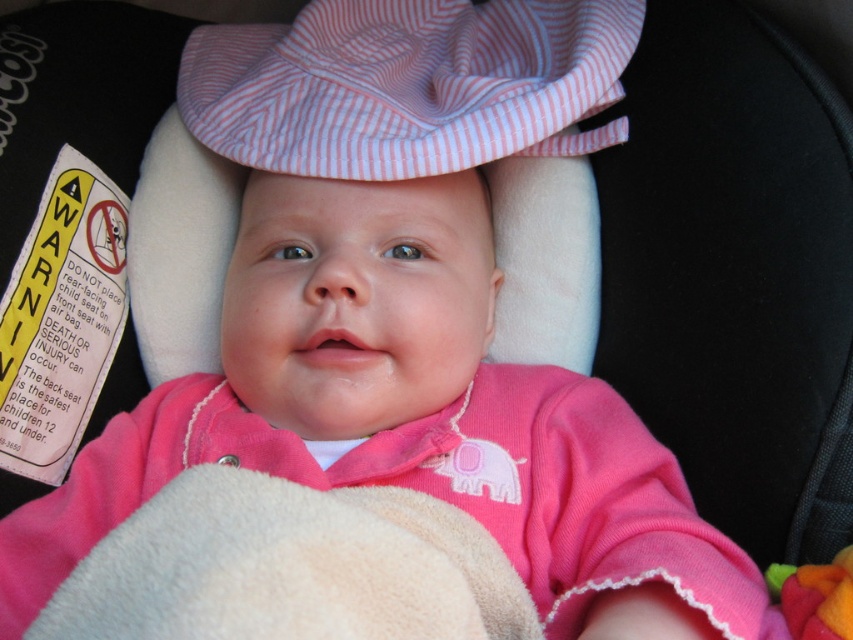
You are a parent checking the car seat for your baby. You notice the pink striped fabric hat at upper center and the fluffy felt toy at lower right. Which object is bigger in size?

The pink striped fabric hat at upper center has a larger size compared to the fluffy felt toy at lower right, so the pink striped fabric hat at upper center is bigger.

You are a photographer adjusting the lighting in a studio setup. You need to ensure that the pink striped fabric hat at upper center is well lit. Based on the scene description, where should you place the main light relative to the hat to achieve optimal lighting?

The pink striped fabric hat at upper center is located at point (408, 84). To achieve optimal lighting, the main light should be positioned slightly to the left and above the hat to ensure even illumination and reduce shadows.